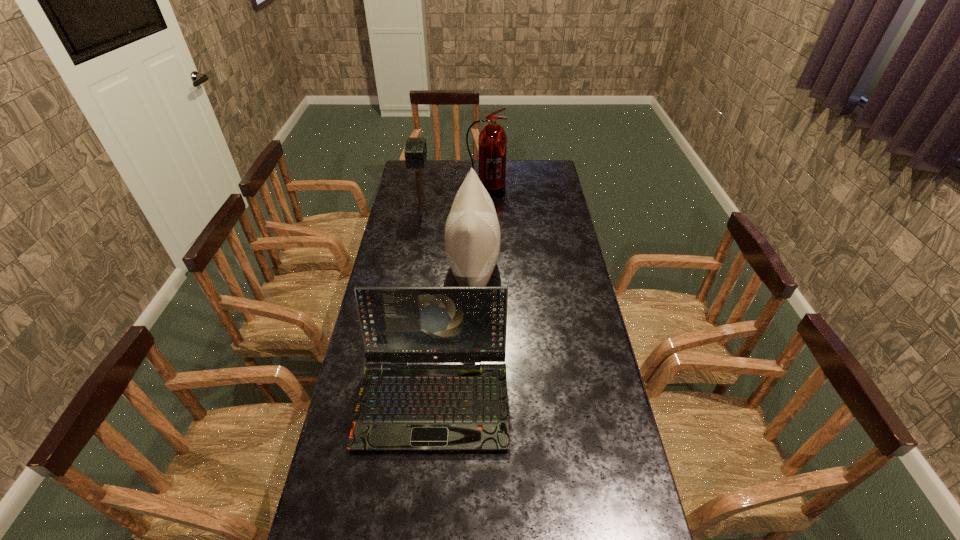
Locate an element on the screen. the farthest object is located at coordinates click(x=492, y=143).

At what (x,y) coordinates should I click in order to perform the action: click on fire extinguisher. Please return your answer as a coordinate pair (x, y). This screenshot has width=960, height=540. Looking at the image, I should click on (492, 143).

Find the location of a particular element. cushion is located at coordinates (472, 233).

The height and width of the screenshot is (540, 960). Find the location of `the third nearest object`. the third nearest object is located at coordinates (415, 152).

Image resolution: width=960 pixels, height=540 pixels. In order to click on laptop computer in this screenshot , I will do `click(401, 406)`.

Image resolution: width=960 pixels, height=540 pixels. In order to click on free region located on the front-facing side of the fire extinguisher in this screenshot , I will do `click(487, 221)`.

This screenshot has width=960, height=540. I want to click on free space located 0.240m on the front side of the third farthest object, so (563, 271).

Where is `free point located on the right of the mallet`? The image size is (960, 540). free point located on the right of the mallet is located at coordinates (442, 209).

The width and height of the screenshot is (960, 540). I want to click on vacant space located on the screen of the laptop computer, so (426, 484).

Locate an element on the screen. object that is positioned at the far edge is located at coordinates (492, 143).